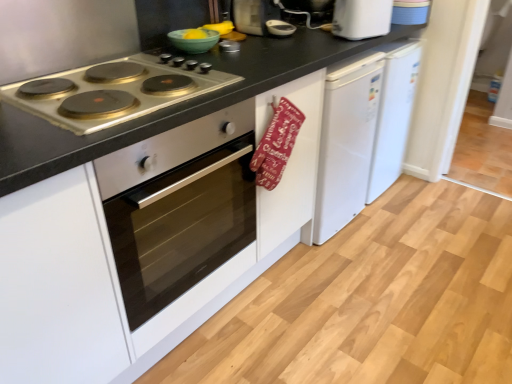
Find the location of a particular element. This screenshot has width=512, height=384. free space to the left of white plastic toaster at upper right is located at coordinates (311, 35).